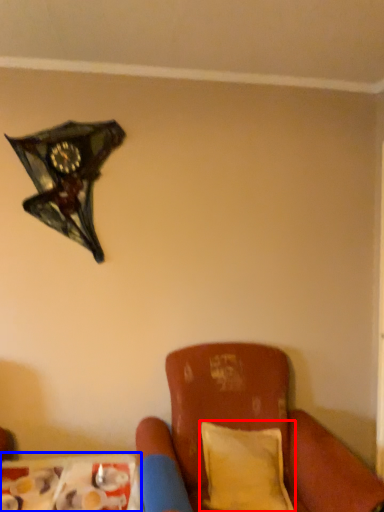
Question: Which of the following is the closest to the observer, pillow (highlighted by a red box) or table (highlighted by a blue box)?

Choices:
 (A) pillow
 (B) table

Answer: (B)